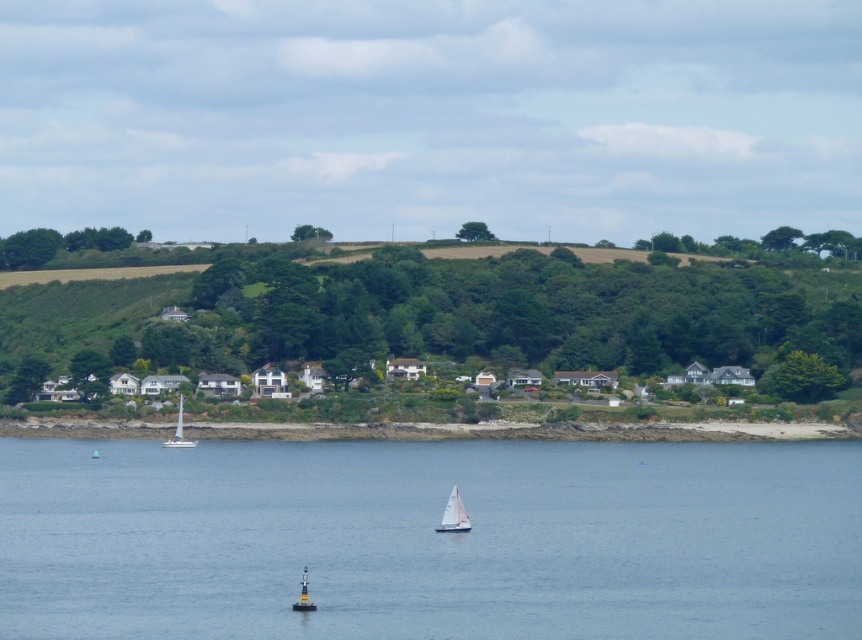
Measure the distance from transparent blue water at center to white sailboat at left.

They are 80.77 meters apart.

Which is in front, point (813, 598) or point (178, 429)?

Positioned in front is point (813, 598).

Identify the location of transparent blue water at center. The height and width of the screenshot is (640, 862). (429, 540).

The width and height of the screenshot is (862, 640). What do you see at coordinates (454, 515) in the screenshot?
I see `white sailboat at center` at bounding box center [454, 515].

Can you confirm if white sailboat at center is smaller than white sailboat at left?

Incorrect, white sailboat at center is not smaller in size than white sailboat at left.

Who is more forward, (454, 502) or (180, 422)?

Point (454, 502) is in front.

Identify the location of white sailboat at center. (454, 515).

Find the location of a particular element. This screenshot has height=640, width=862. transparent blue water at center is located at coordinates (429, 540).

Between transparent blue water at center and green leafy hillside at center, which one appears on the left side from the viewer's perspective?

transparent blue water at center

The width and height of the screenshot is (862, 640). Find the location of `transparent blue water at center`. transparent blue water at center is located at coordinates (429, 540).

Locate an element on the screen. transparent blue water at center is located at coordinates (429, 540).